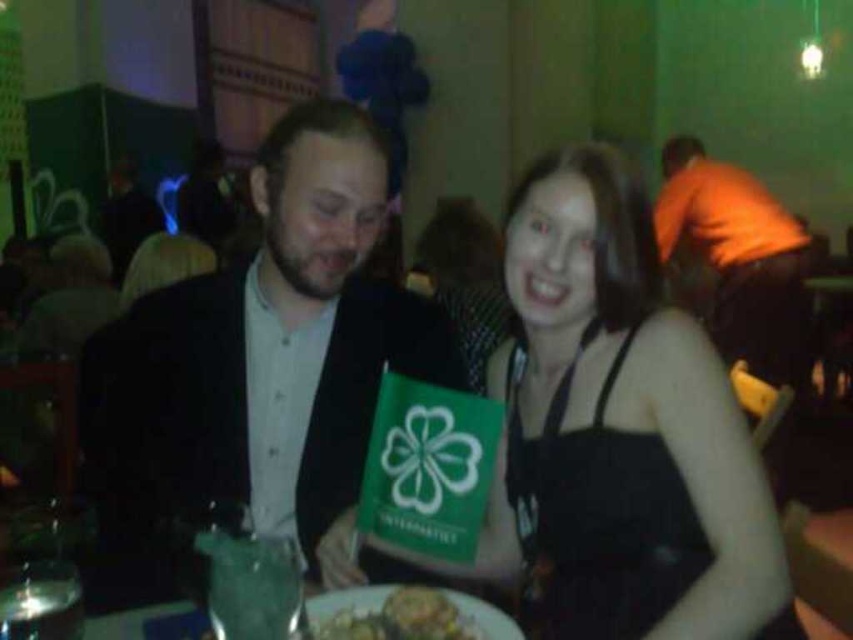
You are sitting at a table in a party and want to reach for the yellowish matte plate at lower center. There is a matte black suit at center in the way. Can you easily reach the plate without moving the suit?

The matte black suit at center is further to the viewer than the yellowish matte plate at lower center, so the plate is closer to you. Therefore, you can easily reach the plate without moving the suit.

You are standing in the room and want to move towards the two points marked in the image. Which point, point [590,593] or point [679,209], is closer to you?

Point [590,593] is closer to the viewer than point [679,209].